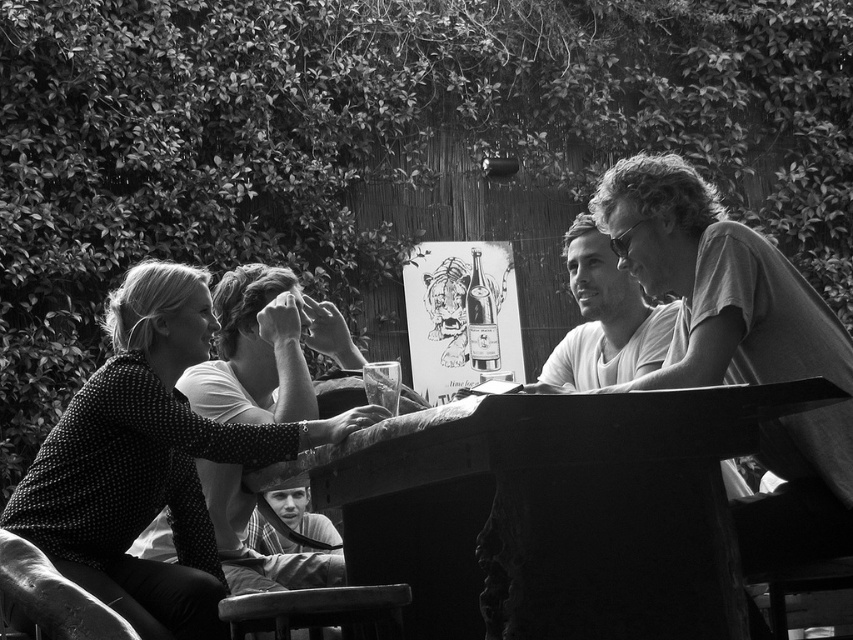
Question: Is polka dot fabric shirt at left below smooth gray shirt at right?

Choices:
 (A) no
 (B) yes

Answer: (B)

Question: In this image, where is smooth wooden table at center located relative to smooth gray shirt at right?

Choices:
 (A) above
 (B) below

Answer: (B)

Question: From the image, what is the correct spatial relationship of smooth wooden table at center in relation to smooth gray shirt at right?

Choices:
 (A) above
 (B) below

Answer: (B)

Question: Which object is farther from the camera taking this photo?

Choices:
 (A) smooth wooden table at center
 (B) smooth white shirt at center
 (C) polka dot fabric shirt at left
 (D) smooth fabric cap at lower center

Answer: (D)

Question: Among these objects, which one is nearest to the camera?

Choices:
 (A) smooth white shirt at center
 (B) smooth fabric cap at lower center
 (C) polka dot fabric shirt at left

Answer: (C)

Question: Which point is closer to the camera?

Choices:
 (A) smooth fabric cap at lower center
 (B) smooth white shirt at center

Answer: (B)